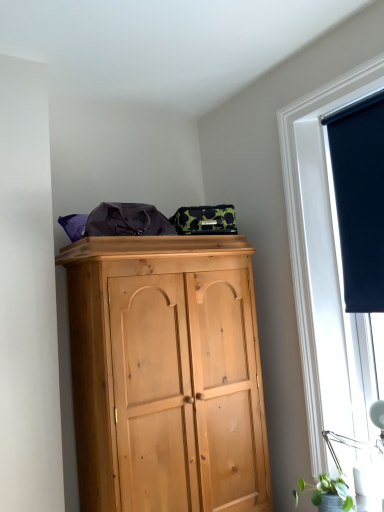
Describe the element at coordinates (359, 199) in the screenshot. Image resolution: width=384 pixels, height=512 pixels. I see `dark blue fabric at upper right` at that location.

The width and height of the screenshot is (384, 512). What do you see at coordinates (325, 268) in the screenshot?
I see `matte black roller blind at right` at bounding box center [325, 268].

Where is `green matte plant at lower right`? The height and width of the screenshot is (512, 384). green matte plant at lower right is located at coordinates (329, 490).

Is point (346, 485) in front of point (308, 213)?

Yes, point (346, 485) is closer to viewer.

In the scene shown: Is green matte plant at lower right beside matte black roller blind at right?

No, green matte plant at lower right is not making contact with matte black roller blind at right.

In the scene shown: Considering the sizes of green matte plant at lower right and matte black roller blind at right in the image, is green matte plant at lower right bigger or smaller than matte black roller blind at right?

green matte plant at lower right is smaller than matte black roller blind at right.

Is green matte plant at lower right completely or partially inside dark blue fabric at upper right?

No, green matte plant at lower right is not a part of dark blue fabric at upper right.

Is dark blue fabric at upper right touching green matte plant at lower right?

No, dark blue fabric at upper right is not touching green matte plant at lower right.

Is point (349, 117) behind point (345, 499)?

Yes, point (349, 117) is behind point (345, 499).

Who is shorter, dark blue fabric at upper right or green matte plant at lower right?

Standing shorter between the two is green matte plant at lower right.

Is the position of matte black roller blind at right more distant than that of green matte plant at lower right?

Yes.

Is point (376, 397) more distant than point (341, 497)?

Yes, it is behind point (341, 497).

Is matte black roller blind at right facing towards green matte plant at lower right?

Yes.

Can you confirm if matte black roller blind at right is positioned to the left of green matte plant at lower right?

No, matte black roller blind at right is not to the left of green matte plant at lower right.

Consider the image. Considering the sizes of objects matte black roller blind at right and dark blue fabric at upper right in the image provided, who is bigger, matte black roller blind at right or dark blue fabric at upper right?

Bigger between the two is matte black roller blind at right.

Is matte black roller blind at right to the right of dark blue fabric at upper right from the viewer's perspective?

No.

Does matte black roller blind at right have a greater height compared to dark blue fabric at upper right?

Yes, matte black roller blind at right is taller than dark blue fabric at upper right.

Between point (362, 336) and point (370, 248), which one is positioned behind?

Point (362, 336)

Does green matte plant at lower right have a smaller size compared to dark blue fabric at upper right?

Yes.

Consider the image. Does green matte plant at lower right come in front of dark blue fabric at upper right?

Yes, it is in front of dark blue fabric at upper right.

From the image's perspective, is green matte plant at lower right located beneath dark blue fabric at upper right?

Yes, from the image's perspective, green matte plant at lower right is beneath dark blue fabric at upper right.

How distant is dark blue fabric at upper right from matte black roller blind at right?

dark blue fabric at upper right is 7.38 inches from matte black roller blind at right.

Which of these two, dark blue fabric at upper right or matte black roller blind at right, is smaller?

Smaller between the two is dark blue fabric at upper right.

Looking at this image, does dark blue fabric at upper right turn towards matte black roller blind at right?

Yes, dark blue fabric at upper right faces towards matte black roller blind at right.

From a real-world perspective, is dark blue fabric at upper right located higher than matte black roller blind at right?

Yes, from a real-world perspective, dark blue fabric at upper right is over matte black roller blind at right

Image resolution: width=384 pixels, height=512 pixels. I want to click on plant on the left of the matte black roller blind at right, so click(329, 490).

The width and height of the screenshot is (384, 512). I want to click on plant below the dark blue fabric at upper right (from a real-world perspective), so click(329, 490).

Which object lies nearer to the anchor point dark blue fabric at upper right, green matte plant at lower right or matte black roller blind at right?

matte black roller blind at right is positioned closer to the anchor dark blue fabric at upper right.

Looking at the image, which one is located closer to matte black roller blind at right, green matte plant at lower right or dark blue fabric at upper right?

dark blue fabric at upper right.

Based on their spatial positions, is dark blue fabric at upper right or matte black roller blind at right closer to green matte plant at lower right?

Among the two, matte black roller blind at right is located nearer to green matte plant at lower right.

Considering their positions, is matte black roller blind at right positioned further to dark blue fabric at upper right than green matte plant at lower right?

Among the two, green matte plant at lower right is located further to dark blue fabric at upper right.

From the image, which object appears to be farther from matte black roller blind at right, dark blue fabric at upper right or green matte plant at lower right?

Among the two, green matte plant at lower right is located further to matte black roller blind at right.

Estimate the real-world distances between objects in this image. Which object is closer to green matte plant at lower right, matte black roller blind at right or dark blue fabric at upper right?

Based on the image, matte black roller blind at right appears to be nearer to green matte plant at lower right.

You are a GUI agent. You are given a task and a screenshot of the screen. Output one action in this format:
    pyautogui.click(x=<x>, y=<y>)
    Task: Click on the window between dark blue fabric at upper right and green matte plant at lower right from top to bottom
    The width and height of the screenshot is (384, 512).
    Given the screenshot: What is the action you would take?
    pyautogui.click(x=325, y=268)